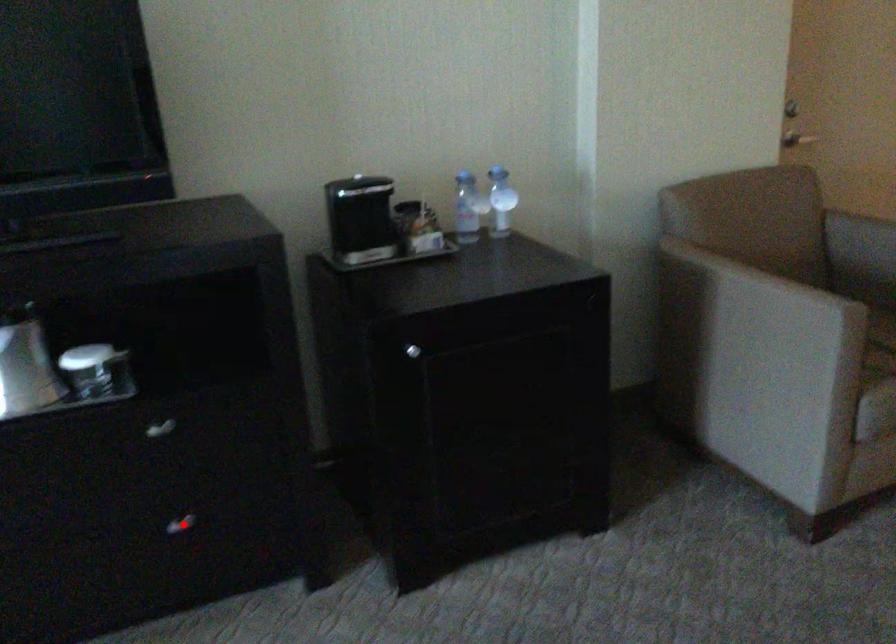
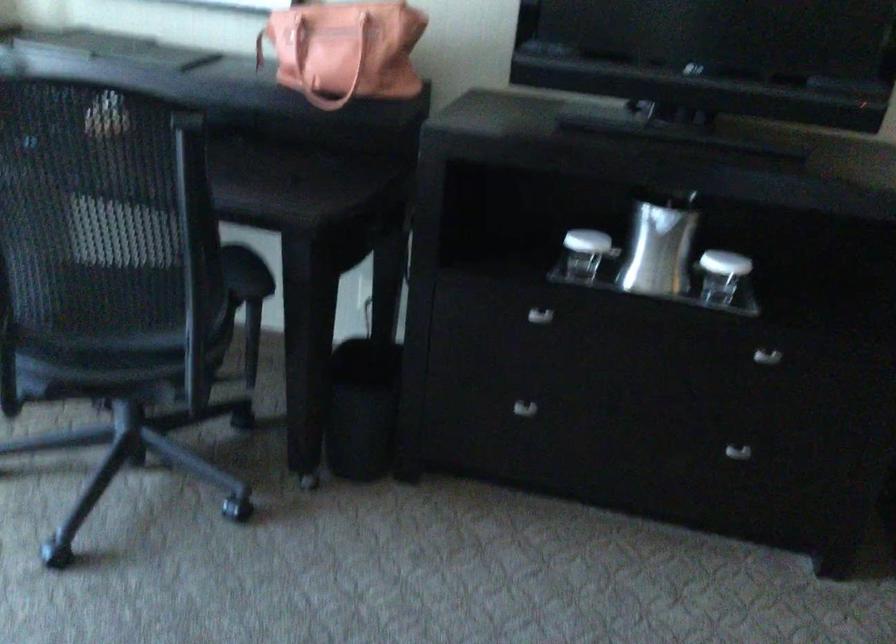
In the second image, find the point that corresponds to the highlighted location in the first image.

(737, 451)